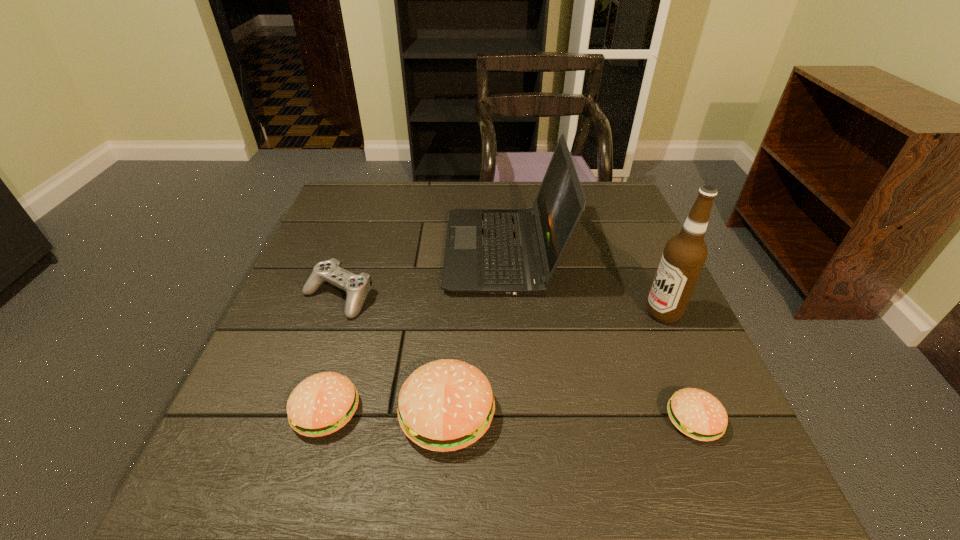
I want to click on the leftmost patty, so [x=323, y=403].

Where is `the third tallest object`? The height and width of the screenshot is (540, 960). the third tallest object is located at coordinates coord(445,405).

Identify the location of the tallest patty. (445, 405).

Locate an element on the screen. The image size is (960, 540). the rightmost patty is located at coordinates (696, 413).

Where is `the shortest object`? This screenshot has width=960, height=540. the shortest object is located at coordinates (696, 413).

Find the location of a particular element. The width and height of the screenshot is (960, 540). alcohol is located at coordinates (685, 254).

At what (x,y) coordinates should I click in order to perform the action: click on control. Please return your answer as a coordinate pair (x, y). Looking at the image, I should click on (356, 287).

This screenshot has width=960, height=540. Find the location of `laptop_computer`. laptop_computer is located at coordinates (488, 251).

Locate an element on the screen. The width and height of the screenshot is (960, 540). free spot located 0.090m on the left of the leftmost patty is located at coordinates (244, 411).

This screenshot has height=540, width=960. I want to click on free point located 0.130m on the back of the tallest patty, so click(x=453, y=327).